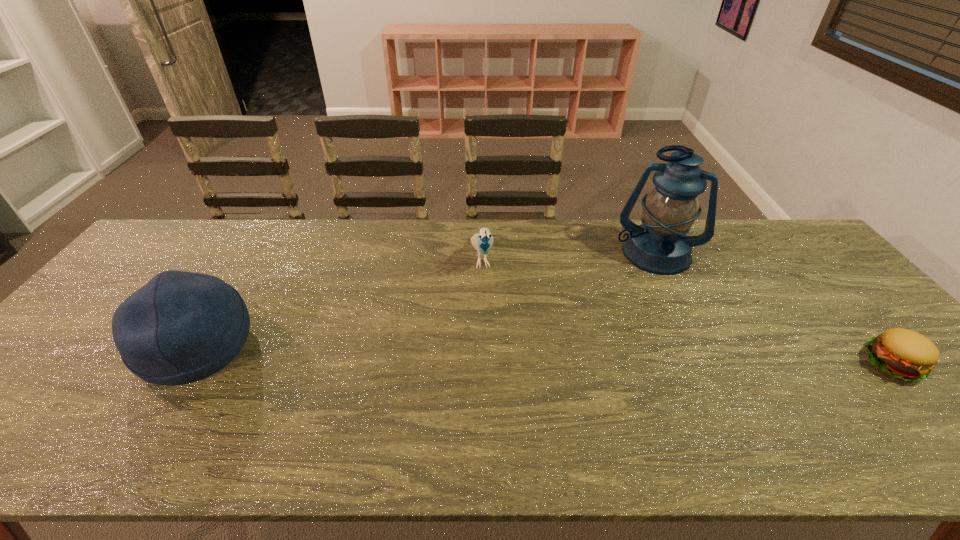
Locate an element on the screen. This screenshot has height=540, width=960. object that is at the right edge is located at coordinates (903, 354).

Identify the location of object present at the near right corner. (903, 354).

Find the location of a particular element. This screenshot has width=960, height=540. blank space at the far edge is located at coordinates (410, 234).

In order to click on free spot at the near edge of the desktop in this screenshot , I will do `click(737, 406)`.

I want to click on vacant space at the left edge, so coord(72,361).

The height and width of the screenshot is (540, 960). What are the coordinates of `blank area at the right edge` in the screenshot? It's located at (833, 300).

Find the location of a particular element. vacant space at the far left corner of the desktop is located at coordinates (196, 232).

Identify the location of free region at the near left corner of the desktop. (15, 390).

What are the coordinates of `free spot between the shortest object and the third tallest object` in the screenshot? It's located at (686, 310).

The height and width of the screenshot is (540, 960). I want to click on free area in between the tallest object and the bird, so click(x=567, y=256).